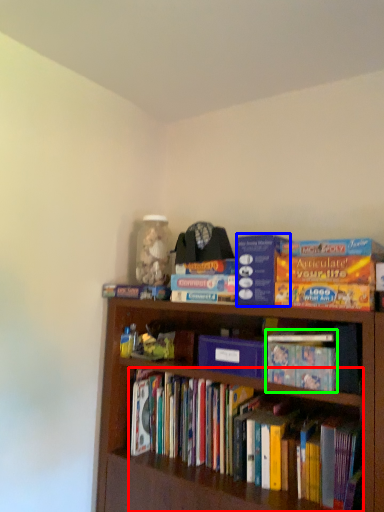
Question: Based on their relative distances, which object is farther from book (highlighted by a red box)? Choose from paperback book (highlighted by a blue box) and book (highlighted by a green box).

Choices:
 (A) paperback book
 (B) book

Answer: (A)